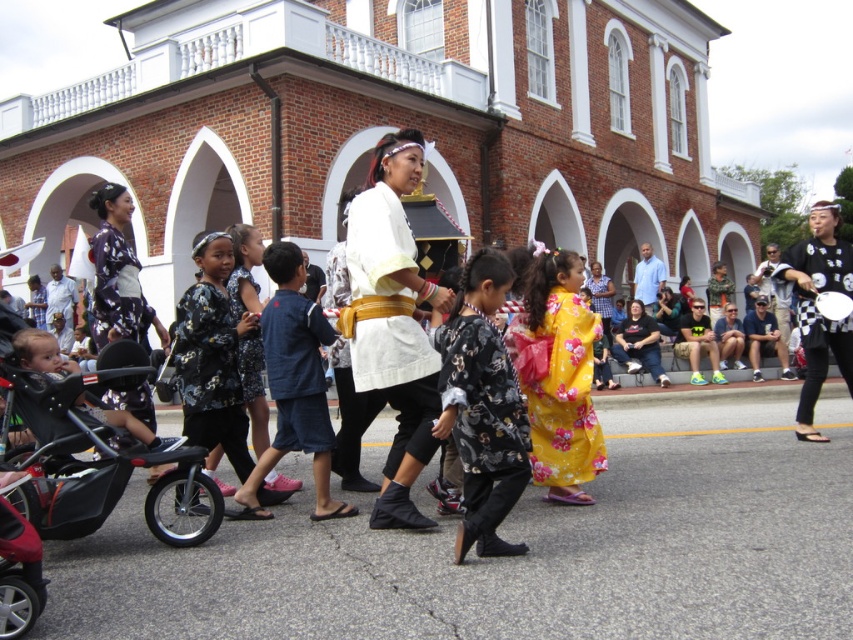
Is denim shorts at center smaller than black satin kimono at left?

Yes.

Who is lower down, denim shorts at center or black satin kimono at left?

denim shorts at center is below.

Is point (341, 508) less distant than point (99, 289)?

Yes, it is.

The height and width of the screenshot is (640, 853). In order to click on denim shorts at center in this screenshot , I will do `click(294, 385)`.

Is white matte kimono at center to the right of black plastic stroller at lower left from the viewer's perspective?

Yes, white matte kimono at center is to the right of black plastic stroller at lower left.

Is point (373, 387) behind point (61, 360)?

Yes, point (373, 387) is farther from viewer.

Where is `white matte kimono at center`? The height and width of the screenshot is (640, 853). white matte kimono at center is located at coordinates (393, 321).

Is white cotton kimono at center shorter than yellow floral kimono at center?

No, white cotton kimono at center is not shorter than yellow floral kimono at center.

Who is more forward, (213,412) or (550,458)?

Point (550,458)

Locate an element on the screen. The height and width of the screenshot is (640, 853). white cotton kimono at center is located at coordinates (393, 314).